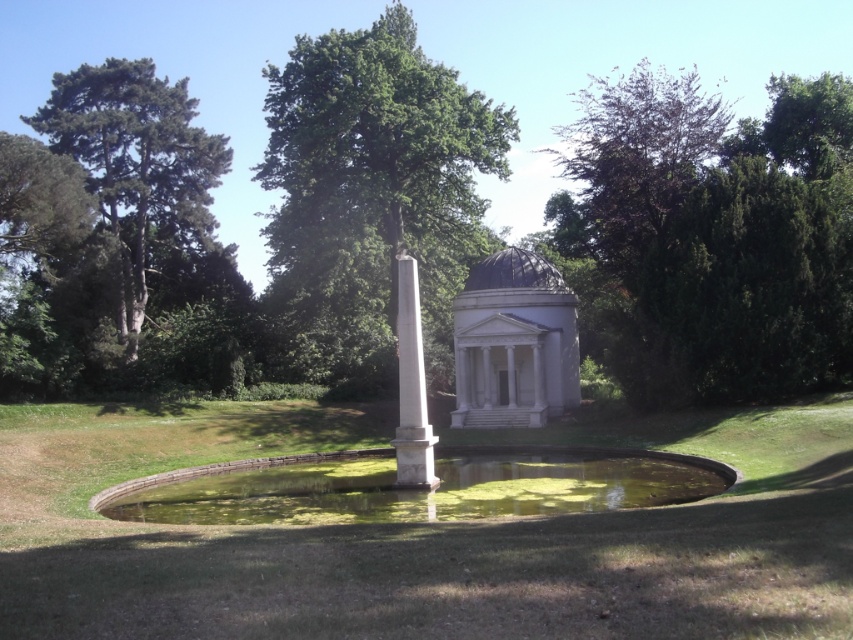
Based on the photo, who is more distant from viewer, (311, 61) or (465, 400)?

Point (311, 61)

Where is `green leafy tree at upper center`? green leafy tree at upper center is located at coordinates (372, 186).

Does green leafy tree at left appear under white marble gazebo at center?

Incorrect, green leafy tree at left is not positioned below white marble gazebo at center.

Is green leafy tree at left positioned at the back of white marble gazebo at center?

Yes, it is.

Where is `green leafy tree at left`? Image resolution: width=853 pixels, height=640 pixels. green leafy tree at left is located at coordinates (135, 163).

Does point (165, 166) lie behind point (419, 419)?

Yes, it is.

Which is below, green leafy tree at left or white marble obelisk at center?

white marble obelisk at center is below.

Image resolution: width=853 pixels, height=640 pixels. What do you see at coordinates (135, 163) in the screenshot?
I see `green leafy tree at left` at bounding box center [135, 163].

Where is `green leafy tree at left`? green leafy tree at left is located at coordinates (135, 163).